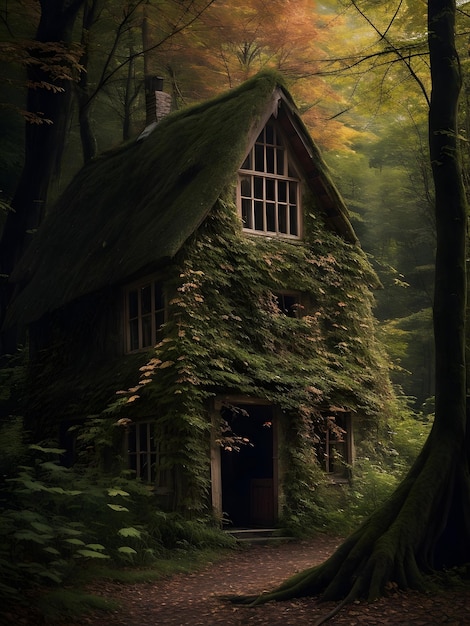
The width and height of the screenshot is (470, 626). I want to click on wooden door frame, so (x=215, y=474).